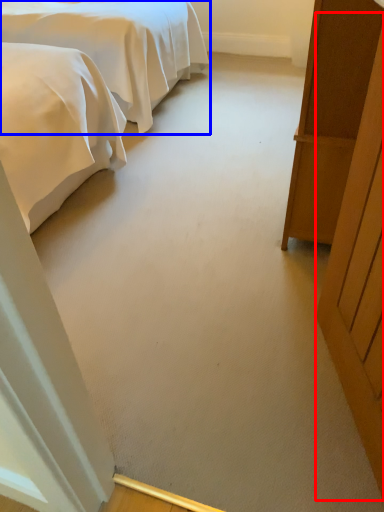
Question: Which object is further to the camera taking this photo, door (highlighted by a red box) or bed (highlighted by a blue box)?

Choices:
 (A) door
 (B) bed

Answer: (B)